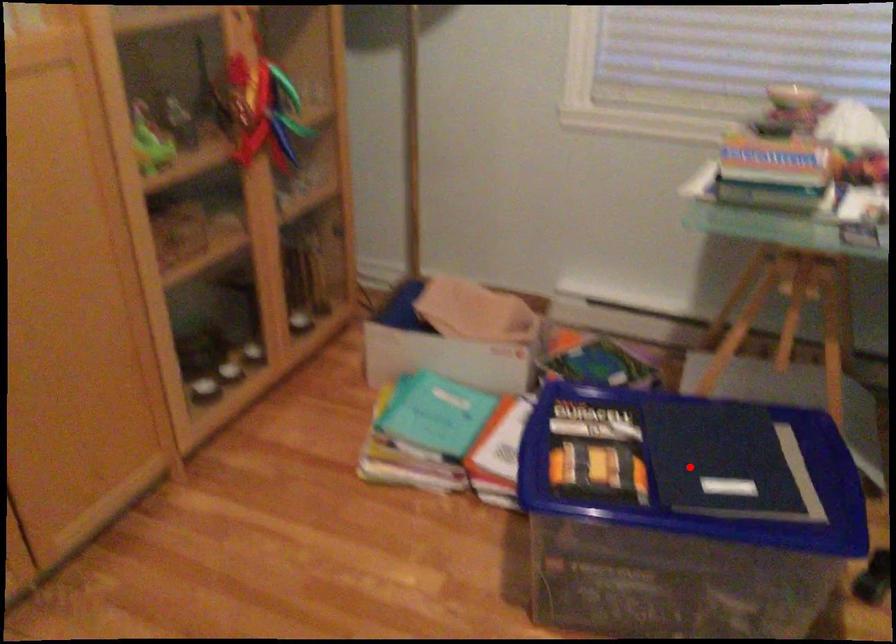
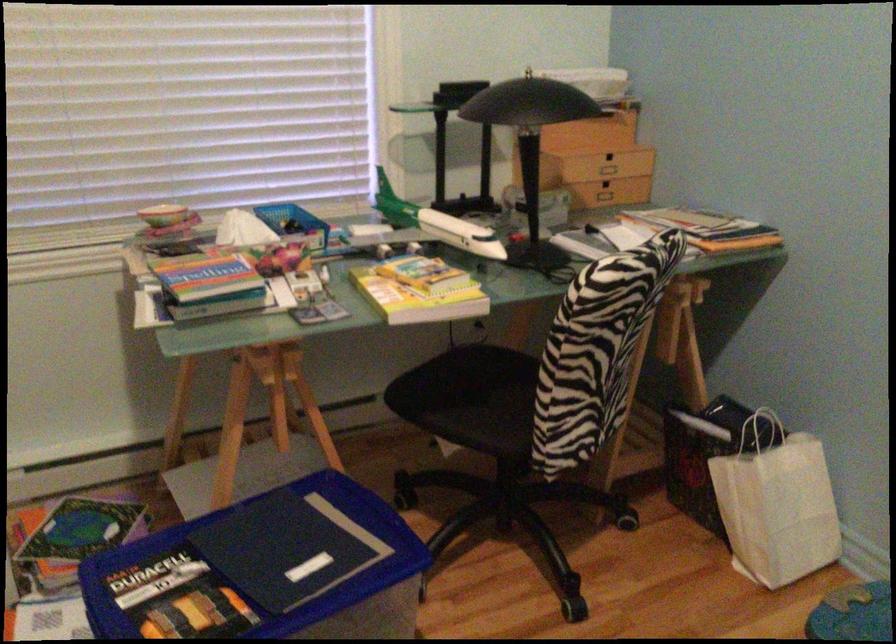
Find the pixel in the second image that matches the highlighted location in the first image.

(264, 570)